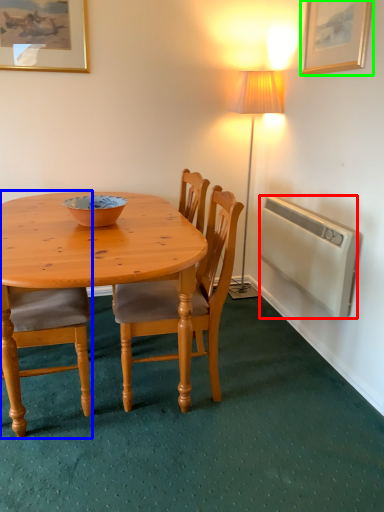
Question: Which object is positioned closest to radiator (highlighted by a red box)? Select from chair (highlighted by a blue box) and picture frame (highlighted by a green box).

Choices:
 (A) chair
 (B) picture frame

Answer: (B)